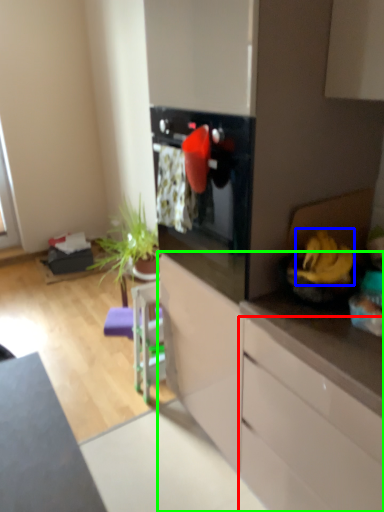
Question: Considering the real-world distances, which object is closest to cabinetry (highlighted by a red box)? banana (highlighted by a blue box) or cabinetry (highlighted by a green box).

Choices:
 (A) banana
 (B) cabinetry

Answer: (B)